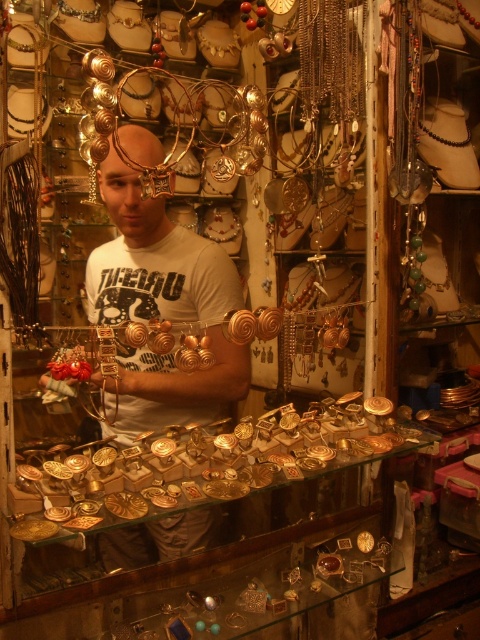
You are a customer in the jewelry shop and want to locate the gold shiny belt buckle at center. According to the coordinates provided, where exactly would you find it in the shop?

The gold shiny belt buckle at center is located at coordinates point 0.744 on the x axis and 0.452 on the y axis.